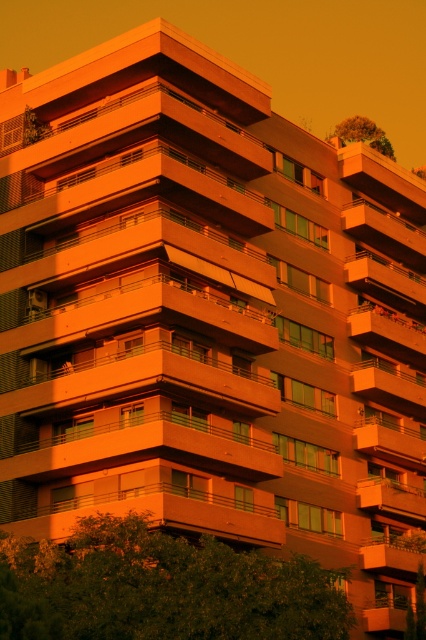
Question: Which point is closer to the camera taking this photo?

Choices:
 (A) (357, 128)
 (B) (279, 564)

Answer: (B)

Question: In this image, where is green leafy tree at lower center located relative to green leafy tree at upper right?

Choices:
 (A) right
 (B) left

Answer: (B)

Question: Which object is closer to the camera taking this photo?

Choices:
 (A) green leafy tree at lower center
 (B) green leafy tree at upper right

Answer: (A)

Question: Can you confirm if green leafy tree at lower center is positioned to the right of green leafy tree at upper right?

Choices:
 (A) yes
 (B) no

Answer: (B)

Question: Is green leafy tree at lower center positioned in front of green leafy tree at upper right?

Choices:
 (A) no
 (B) yes

Answer: (B)